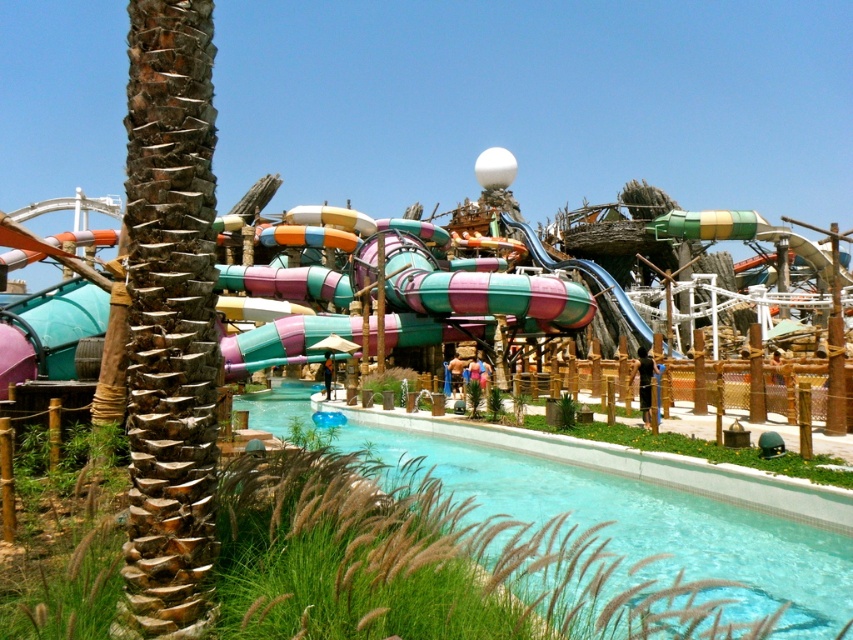
Who is positioned more to the left, brown/scaly trunk at left or clear glass pool at center?

Positioned to the left is brown/scaly trunk at left.

Is brown/scaly trunk at left thinner than clear glass pool at center?

Yes, brown/scaly trunk at left is thinner than clear glass pool at center.

Which is in front, point (155, 317) or point (647, 573)?

Positioned in front is point (155, 317).

Where is `brown/scaly trunk at left`? brown/scaly trunk at left is located at coordinates (169, 314).